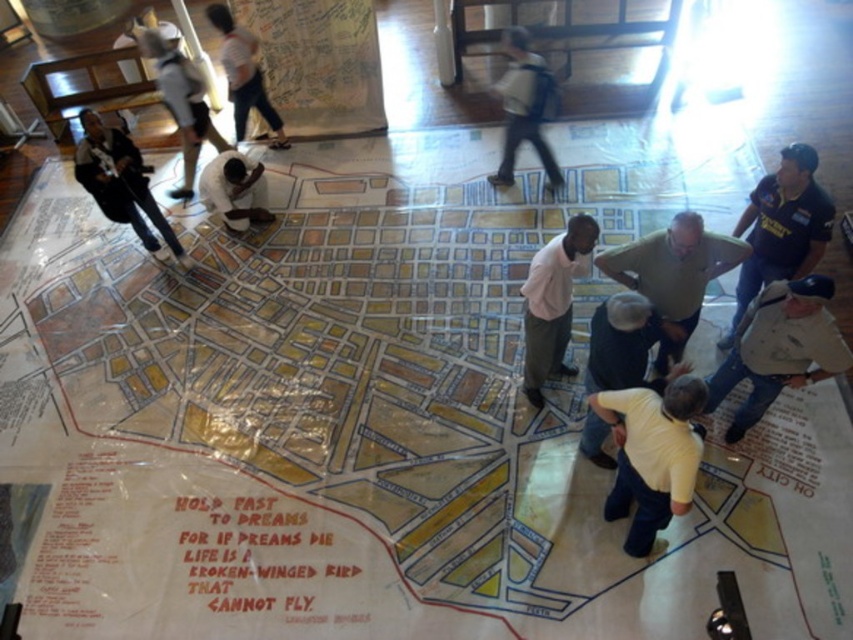
You are standing in the center of the map and want to place a small sticker exactly at the location marked by the dark blue jeans at lower left. What are the coordinates where you should place the sticker?

The coordinates for the dark blue jeans at lower left are at point (120, 182), so place the sticker at those coordinates.

You are standing in the indoor space where the map is displayed. You see two points on the map labeled as point (590, 237) and point (503, 157). Which point is closer to you?

Point (590, 237) is in front of point (503, 157), so it is closer to you.